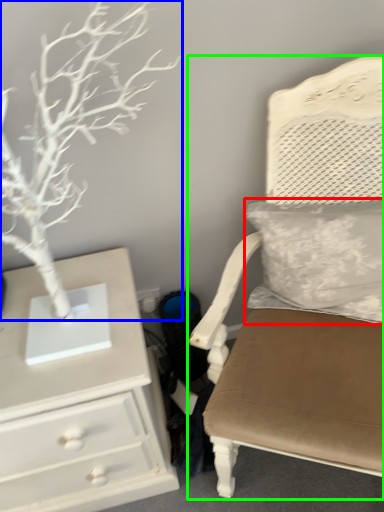
Question: Which object is the farthest from pillow (highlighted by a red box)? Choose among these: tree (highlighted by a blue box) or chair (highlighted by a green box).

Choices:
 (A) tree
 (B) chair

Answer: (A)